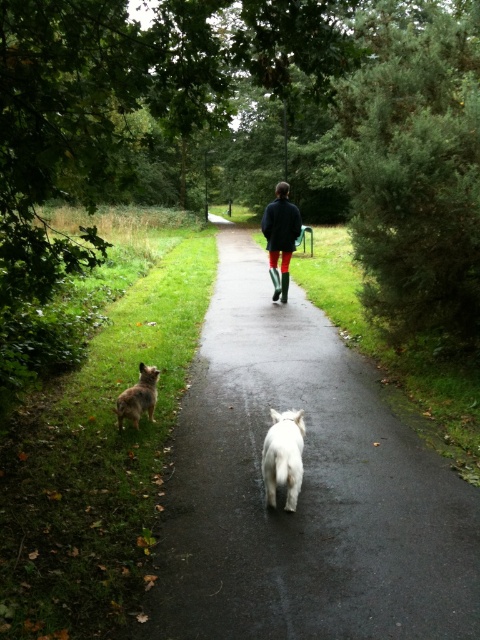
You are standing at the starting point of the pathway in the image. There is a white fluffy dog at center located at point [284,456]. If you want to walk towards the white fluffy dog at center, which direction should you move relative to the pathway?

You should move towards the center of the pathway since the white fluffy dog at center is located at point [284,456], which is the central area of the image.

You are a hiker planning to walk along the dark asphalt path at center with your white fluffy dog at center. Considering the path width, will you have enough space to walk comfortably with your dog on either side of you?

The dark asphalt path at center is wider than the white fluffy dog at center, so you will have enough space to walk comfortably with your dog on either side of you.

From the picture: You are standing at the start of the dark asphalt path at center and want to reach the brown fur dog at lower left. Which direction should you walk to get closer to the dog?

The dark asphalt path at center is positioned on the right side of the brown fur dog at lower left, so you should walk to the left to move towards the dog.